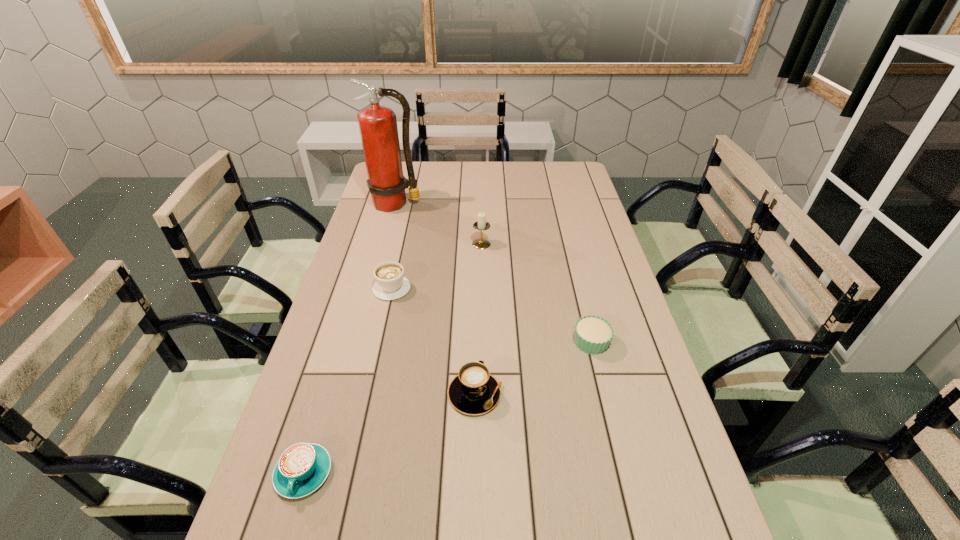
The image size is (960, 540). I want to click on vacant area that lies between the rightmost cappuccino and the fire extinguisher, so click(436, 299).

Where is `vacant space that is in between the candle holder and the fourth nearest object`? The width and height of the screenshot is (960, 540). vacant space that is in between the candle holder and the fourth nearest object is located at coordinates (437, 266).

I want to click on empty space between the fire extinguisher and the rightmost cappuccino, so click(436, 299).

You are a GUI agent. You are given a task and a screenshot of the screen. Output one action in this format:
    pyautogui.click(x=<x>, y=<y>)
    Task: Click on the free space between the rightmost object and the tallest object
    
    Given the screenshot: What is the action you would take?
    pyautogui.click(x=493, y=273)

This screenshot has height=540, width=960. In order to click on the second closest object relative to the shortest cappuccino in this screenshot , I will do `click(390, 284)`.

Locate an element on the screen. the closest object to the shortest cappuccino is located at coordinates (474, 391).

Select which cappuccino appears as the closest to the second farthest cappuccino. Please provide its 2D coordinates. Your answer should be formatted as a tuple, i.e. [(x, y)], where the tuple contains the x and y coordinates of a point satisfying the conditions above.

[(302, 468)]

You are a GUI agent. You are given a task and a screenshot of the screen. Output one action in this format:
    pyautogui.click(x=<x>, y=<y>)
    Task: Click on the second closest cappuccino to the second nearest object
    This screenshot has width=960, height=540.
    Given the screenshot: What is the action you would take?
    pyautogui.click(x=390, y=284)

Where is `vacant space that satisfies the following two spatial constraints: 1. at the nozzle of the fire extinguisher; 2. on the left side of the candle holder`? This screenshot has height=540, width=960. vacant space that satisfies the following two spatial constraints: 1. at the nozzle of the fire extinguisher; 2. on the left side of the candle holder is located at coordinates (385, 244).

You are a GUI agent. You are given a task and a screenshot of the screen. Output one action in this format:
    pyautogui.click(x=<x>, y=<y>)
    Task: Click on the free spot that satisfies the following two spatial constraints: 1. at the nozzle of the fifth farthest object; 2. on the left side of the farthest object
    
    Given the screenshot: What is the action you would take?
    pyautogui.click(x=344, y=394)